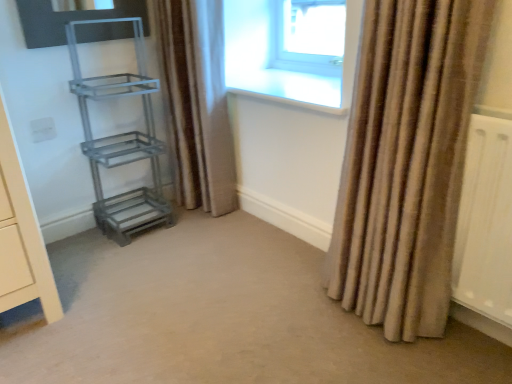
Question: Do you think metallic gray shelf at left, which ranks as the 1th shelf in top-to-bottom order, is within brown textured curtain at center, the 2th curtain positioned from the front, or outside of it?

Choices:
 (A) outside
 (B) inside

Answer: (A)

Question: Is point (105, 87) positioned closer to the camera than point (176, 162)?

Choices:
 (A) closer
 (B) farther

Answer: (A)

Question: Which object is the closest to the transparent glass window at upper center?

Choices:
 (A) beige textured curtain at right, which appears as the second curtain when viewed from the back
 (B) brown textured curtain at center, the 2th curtain when ordered from right to left
 (C) carpet at center
 (D) metallic gray shelf at left, which ranks as the 1th shelf in top-to-bottom order
 (E) metallic gray shelf at lower left, which ranks as the second shelf in top-to-bottom order

Answer: (B)

Question: Estimate the real-world distances between objects in this image. Which object is farther from the beige textured curtain at right, which appears as the 2th curtain when viewed from the left?

Choices:
 (A) carpet at center
 (B) metallic gray shelf at lower left, the first shelf positioned from the bottom
 (C) transparent glass window at upper center
 (D) metallic gray shelf at left, which is counted as the 2th shelf, starting from the bottom
 (E) brown textured curtain at center, acting as the first curtain starting from the back

Answer: (C)